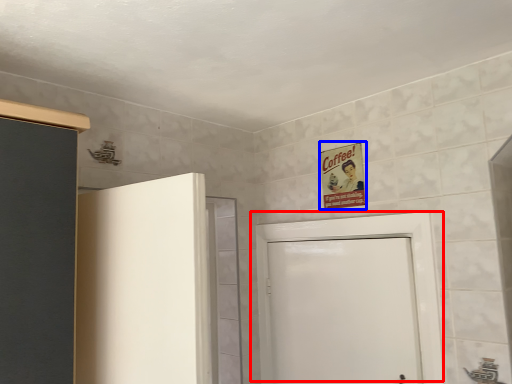
Question: Which of the following is the farthest to the observer, door (highlighted by a red box) or poster (highlighted by a blue box)?

Choices:
 (A) door
 (B) poster

Answer: (B)